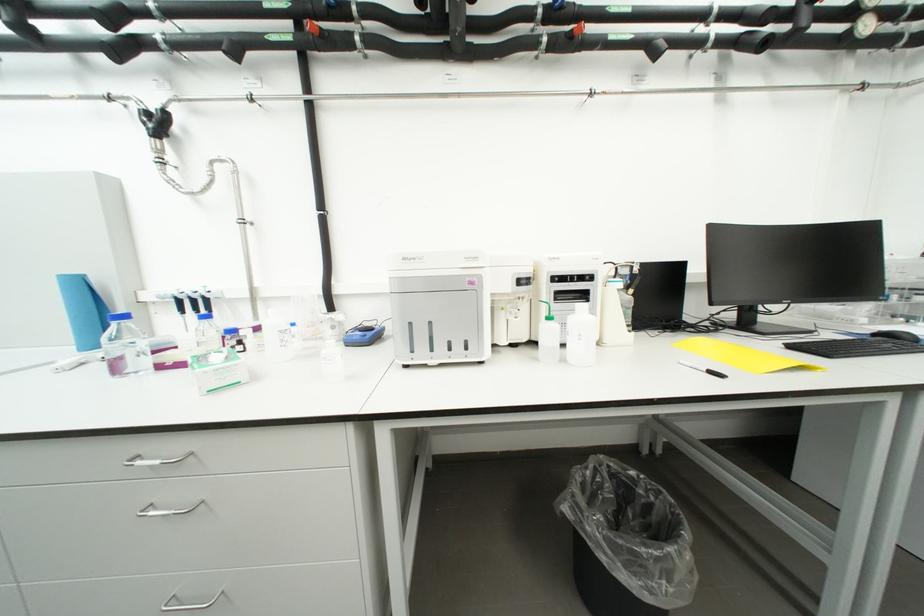
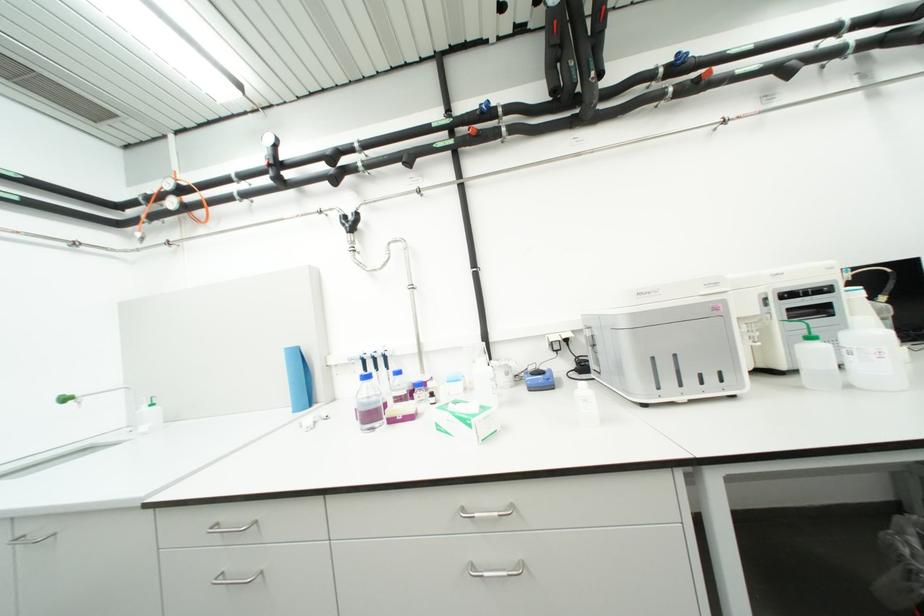
In the second image, find the point that corresponds to point 556,320 in the first image.

(819, 339)